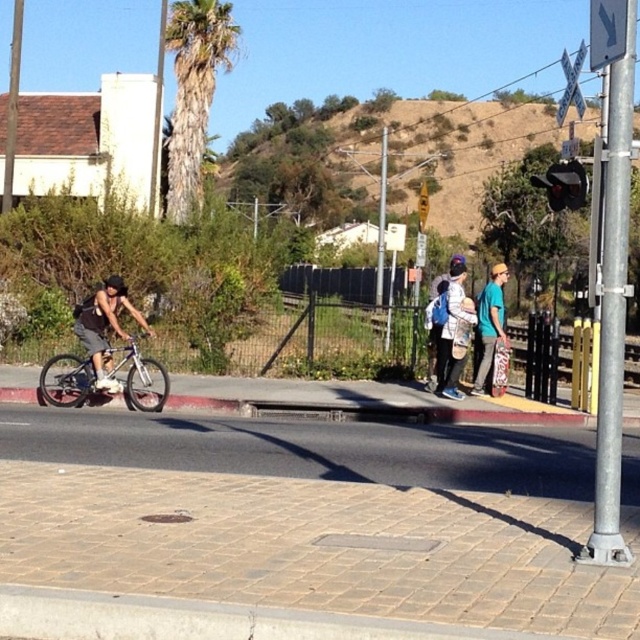
Question: Can you confirm if green leafy palm tree at upper left is wider than matte blue backpack at center?

Choices:
 (A) no
 (B) yes

Answer: (B)

Question: Does brick pavement at lower center appear under teal fabric hoodie at center?

Choices:
 (A) no
 (B) yes

Answer: (B)

Question: Which object is the farthest from the brick pavement at lower center?

Choices:
 (A) brushed metal railroad crossing sign at upper right
 (B) green leafy palm tree at upper left
 (C) teal fabric hoodie at center
 (D) silver metallic bicycle at left

Answer: (B)

Question: In this image, where is teal fabric hoodie at center located relative to brushed metal arrow at upper right?

Choices:
 (A) right
 (B) left

Answer: (B)

Question: Which object appears farthest from the camera in this image?

Choices:
 (A) teal fabric hoodie at center
 (B) matte blue backpack at center
 (C) brushed metal arrow at upper right

Answer: (A)

Question: Based on their relative distances, which object is farther from the silver metallic bicycle at left?

Choices:
 (A) green leafy palm tree at upper left
 (B) brushed metal railroad crossing sign at upper right

Answer: (B)